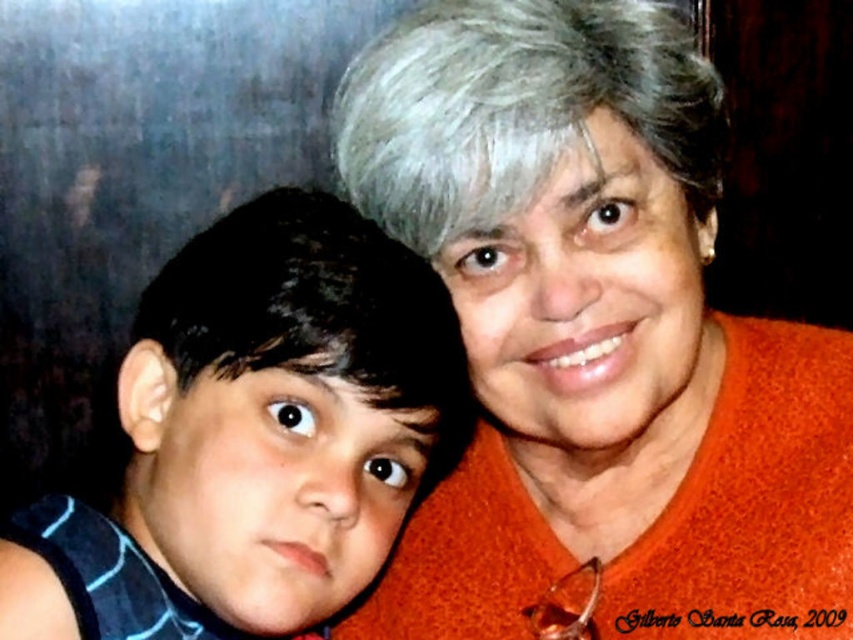
Who is taller, orange fabric at upper right or gray matte hair at upper center?

With more height is orange fabric at upper right.

The width and height of the screenshot is (853, 640). What are the coordinates of `orange fabric at upper right` in the screenshot? It's located at (595, 340).

Identify the location of blue striped shirt at left. (282, 410).

What do you see at coordinates (595, 340) in the screenshot? I see `orange fabric at upper right` at bounding box center [595, 340].

Who is lower down, orange fabric at upper right or blue striped shirt at left?

blue striped shirt at left is below.

Who is more forward, (461, 243) or (339, 278)?

Positioned in front is point (339, 278).

You are a GUI agent. You are given a task and a screenshot of the screen. Output one action in this format:
    pyautogui.click(x=<x>, y=<y>)
    Task: Click on the orange fabric at upper right
    The height and width of the screenshot is (640, 853).
    Given the screenshot: What is the action you would take?
    pyautogui.click(x=595, y=340)